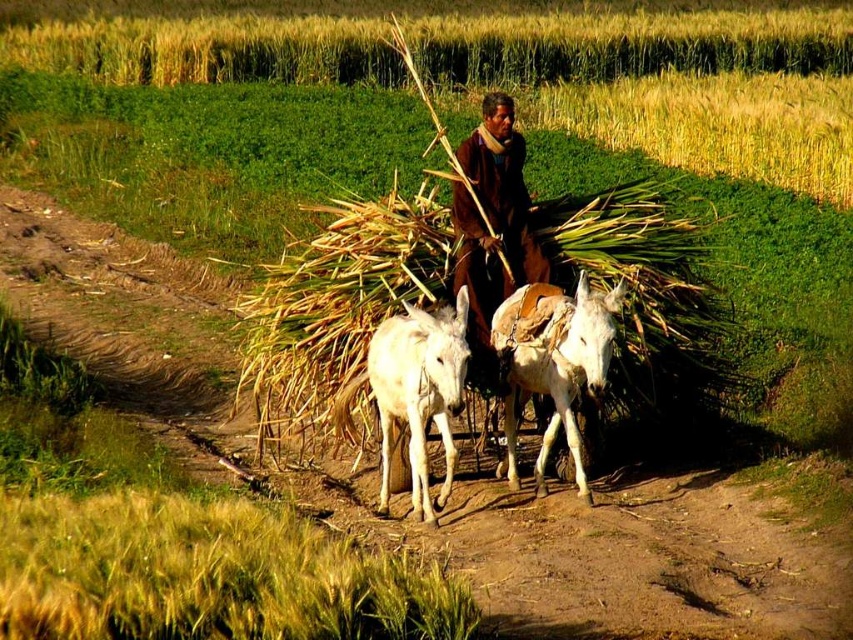
Question: Can you confirm if green straw at center is bigger than white smooth donkey at center?

Choices:
 (A) no
 (B) yes

Answer: (B)

Question: Is green straw at center smaller than white leather donkey at center?

Choices:
 (A) yes
 (B) no

Answer: (B)

Question: Considering the relative positions of green straw at center and white smooth donkey at center in the image provided, where is green straw at center located with respect to white smooth donkey at center?

Choices:
 (A) above
 (B) below

Answer: (A)

Question: Which object is farther from the camera taking this photo?

Choices:
 (A) brown woolen sweater at center
 (B) white smooth donkey at center

Answer: (A)

Question: Which of these objects is positioned farthest from the green straw at center?

Choices:
 (A) white leather donkey at center
 (B) brown woolen sweater at center
 (C) white smooth donkey at center

Answer: (B)

Question: Which of these objects is positioned farthest from the green straw at center?

Choices:
 (A) white smooth donkey at center
 (B) brown woolen sweater at center
 (C) white leather donkey at center

Answer: (B)